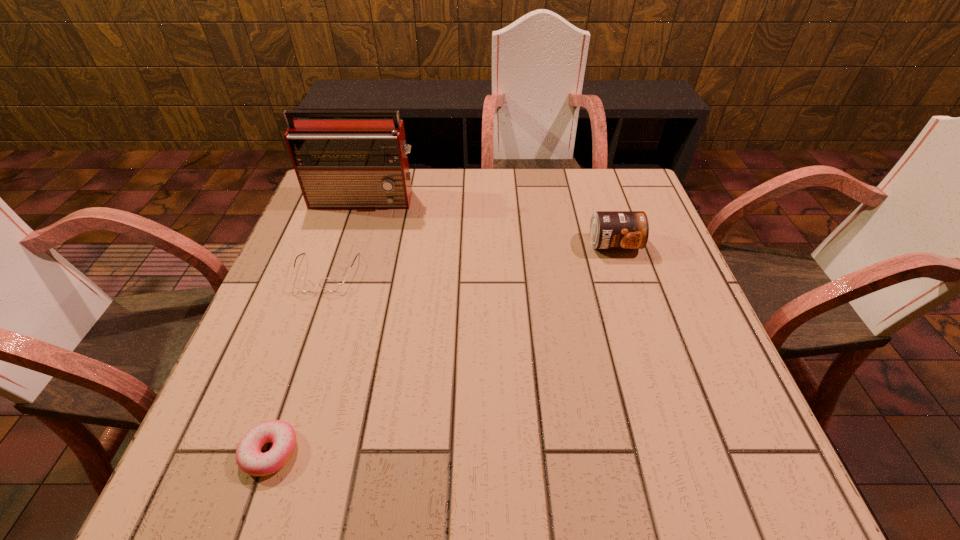
In order to click on vacant space situated 0.250m on the back of the doughnut in this screenshot , I will do `click(317, 314)`.

Image resolution: width=960 pixels, height=540 pixels. Identify the location of object present at the far edge. (340, 163).

You are a GUI agent. You are given a task and a screenshot of the screen. Output one action in this format:
    pyautogui.click(x=<x>, y=<y>)
    Task: Click on the object located in the near edge section of the desktop
    Image resolution: width=960 pixels, height=540 pixels.
    Given the screenshot: What is the action you would take?
    pyautogui.click(x=250, y=459)

Identify the location of radio receiver situated at the left edge. This screenshot has width=960, height=540. (340, 163).

Find the location of a particular element. Image resolution: width=960 pixels, height=540 pixels. spectacles positioned at the left edge is located at coordinates (302, 284).

What are the coordinates of `doughnut present at the left edge` in the screenshot? It's located at (250, 459).

Identify the location of object that is at the right edge. (608, 229).

Where is `object present at the far left corner`? The height and width of the screenshot is (540, 960). object present at the far left corner is located at coordinates (340, 163).

Where is `object that is at the near left corner`? Image resolution: width=960 pixels, height=540 pixels. object that is at the near left corner is located at coordinates (250, 459).

The height and width of the screenshot is (540, 960). I want to click on free space at the far edge, so coord(437,171).